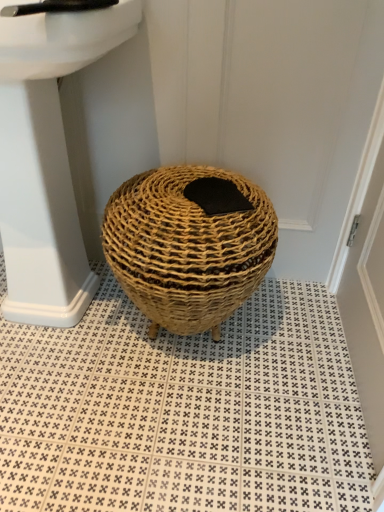
Identify the location of white glossy sink at upper left. (46, 160).

Image resolution: width=384 pixels, height=512 pixels. I want to click on natural woven basket at center, so click(x=189, y=244).

The image size is (384, 512). I want to click on black felt pad at center, so click(217, 196).

I want to click on black plastic faucet at upper left, so click(x=56, y=7).

What do you see at coordinates (56, 7) in the screenshot? I see `black plastic faucet at upper left` at bounding box center [56, 7].

Locate an element on the screen. white glossy sink at upper left is located at coordinates (46, 160).

From a real-world perspective, does black felt pad at center sit lower than white glossy sink at upper left?

No, from a real-world perspective, black felt pad at center is not below white glossy sink at upper left.

Is black felt pad at center in contact with white glossy sink at upper left?

No, black felt pad at center is not with white glossy sink at upper left.

Is black felt pad at center not inside white glossy sink at upper left?

Yes, black felt pad at center is located beyond the bounds of white glossy sink at upper left.

Considering the positions of objects black felt pad at center and white glossy sink at upper left in the image provided, who is behind, black felt pad at center or white glossy sink at upper left?

black felt pad at center is further from the camera.

Is black felt pad at center at the back of natural woven basket at center?

No, natural woven basket at center is not facing away from black felt pad at center.

Which is in front, point (177, 457) or point (224, 211)?

The point (224, 211) is closer.

Between natural woven basket at center and black felt pad at center, which one has more height?

natural woven basket at center is taller.

From a real-world perspective, is natural woven basket at center beneath black felt pad at center?

Yes, from a real-world perspective, natural woven basket at center is under black felt pad at center.

Can you confirm if natural woven basket at center is bigger than natural woven basket at center?

Correct, natural woven basket at center is larger in size than natural woven basket at center.

Does natural woven basket at center appear on the left side of natural woven basket at center?

No.

Measure the distance from white glossy sink at upper left to natural woven basket at center.

They are 16.86 inches apart.

Can you see white glossy sink at upper left touching natural woven basket at center?

No, white glossy sink at upper left is not making contact with natural woven basket at center.

Locate an element on the screen. pattern behind the white glossy sink at upper left is located at coordinates (184, 410).

Is white glossy sink at upper left at the right side of natural woven basket at center?

No.

Is natural woven basket at center facing away from black plastic faucet at upper left?

No, natural woven basket at center's orientation is not away from black plastic faucet at upper left.

Considering the sizes of objects natural woven basket at center and black plastic faucet at upper left in the image provided, who is bigger, natural woven basket at center or black plastic faucet at upper left?

With larger size is natural woven basket at center.

From the image's perspective, between natural woven basket at center and black plastic faucet at upper left, who is located below?

natural woven basket at center.

Between natural woven basket at center and black plastic faucet at upper left, which one is positioned behind?

natural woven basket at center.

Is black plastic faucet at upper left located outside natural woven basket at center?

Yes, black plastic faucet at upper left is located beyond the bounds of natural woven basket at center.

Is black plastic faucet at upper left far away from natural woven basket at center?

black plastic faucet at upper left is near natural woven basket at center, not far away.

Based on the photo, considering the relative positions of black plastic faucet at upper left and natural woven basket at center in the image provided, is black plastic faucet at upper left behind natural woven basket at center?

No, black plastic faucet at upper left is closer to the camera.

Between black plastic faucet at upper left and natural woven basket at center, which one has smaller width?

With smaller width is black plastic faucet at upper left.

Which point is more forward, (8, 14) or (229, 201)?

Positioned in front is point (8, 14).

Which object is more forward, black plastic faucet at upper left or black felt pad at center?

black plastic faucet at upper left.

Can you confirm if black plastic faucet at upper left is positioned to the left of black felt pad at center?

Indeed, black plastic faucet at upper left is positioned on the left side of black felt pad at center.

Is black plastic faucet at upper left beside black felt pad at center?

No, black plastic faucet at upper left is not in contact with black felt pad at center.

Locate an element on the screen. The image size is (384, 512). pad below the white glossy sink at upper left (from the image's perspective) is located at coordinates tap(217, 196).

Image resolution: width=384 pixels, height=512 pixels. In order to click on pattern located in front of the black felt pad at center in this screenshot , I will do `click(184, 410)`.

Looking at this image, estimate the real-world distances between objects in this image. Which object is further from natural woven basket at center, black felt pad at center or natural woven basket at center?

Among the two, natural woven basket at center is located further to natural woven basket at center.

Which object lies nearer to the anchor point black felt pad at center, black plastic faucet at upper left or natural woven basket at center?

natural woven basket at center is closer to black felt pad at center.

Considering their positions, is black plastic faucet at upper left positioned closer to natural woven basket at center than natural woven basket at center?

natural woven basket at center.

Based on their spatial positions, is natural woven basket at center or white glossy sink at upper left closer to black felt pad at center?

Among the two, natural woven basket at center is located nearer to black felt pad at center.

When comparing their distances from natural woven basket at center, does natural woven basket at center or black felt pad at center seem closer?

natural woven basket at center is positioned closer to the anchor natural woven basket at center.

Which object lies nearer to the anchor point natural woven basket at center, natural woven basket at center or black plastic faucet at upper left?

natural woven basket at center is closer to natural woven basket at center.

Estimate the real-world distances between objects in this image. Which object is further from natural woven basket at center, black felt pad at center or white glossy sink at upper left?

black felt pad at center lies further to natural woven basket at center than the other object.

Considering their positions, is black felt pad at center positioned further to white glossy sink at upper left than black plastic faucet at upper left?

Among the two, black felt pad at center is located further to white glossy sink at upper left.

Find the location of a particular element. basket between white glossy sink at upper left and black felt pad at center is located at coordinates (189, 244).

Find the location of `basket between black felt pad at center and natural woven basket at center vertically`. basket between black felt pad at center and natural woven basket at center vertically is located at coordinates (189, 244).

Where is `pad between white glossy sink at upper left and natural woven basket at center in the vertical direction`? This screenshot has width=384, height=512. pad between white glossy sink at upper left and natural woven basket at center in the vertical direction is located at coordinates (217, 196).

At what (x,y) coordinates should I click in order to perform the action: click on sink between black plastic faucet at upper left and natural woven basket at center from top to bottom. Please return your answer as a coordinate pair (x, y). This screenshot has height=512, width=384. Looking at the image, I should click on (46, 160).